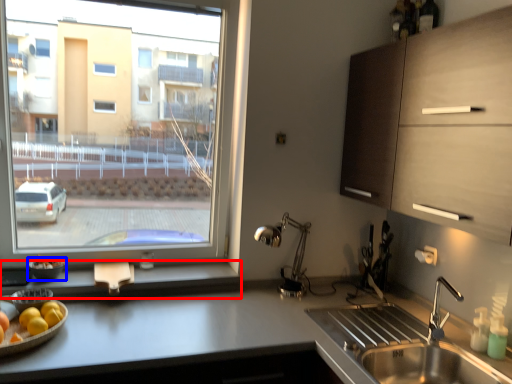
Question: Among these objects, which one is nearest to the camera, window sill (highlighted by a red box) or glass bowl (highlighted by a blue box)?

Choices:
 (A) window sill
 (B) glass bowl

Answer: (A)